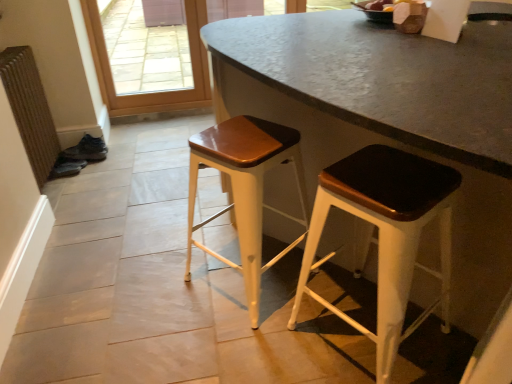
Question: Should I look upward or downward to see brown textured radiator at left?

Choices:
 (A) down
 (B) up

Answer: (B)

Question: Is wooden seat stool at center, acting as the 2th stool starting from the right, behind matte black stool at center, which is counted as the first stool, starting from the right?

Choices:
 (A) yes
 (B) no

Answer: (A)

Question: Is wooden seat stool at center, acting as the 2th stool starting from the right, far away from matte black stool at center, the 2th stool positioned from the left?

Choices:
 (A) yes
 (B) no

Answer: (B)

Question: Does wooden seat stool at center, the 1th stool when ordered from left to right, have a lesser height compared to matte black stool at center, the 2th stool positioned from the left?

Choices:
 (A) no
 (B) yes

Answer: (B)

Question: Considering the relative positions of wooden seat stool at center, the 1th stool when ordered from left to right, and matte black stool at center, which is counted as the first stool, starting from the right, in the image provided, is wooden seat stool at center, the 1th stool when ordered from left to right, to the left of matte black stool at center, which is counted as the first stool, starting from the right, from the viewer's perspective?

Choices:
 (A) no
 (B) yes

Answer: (B)

Question: Considering the relative positions of wooden seat stool at center, the 1th stool when ordered from left to right, and matte black stool at center, which is counted as the first stool, starting from the right, in the image provided, is wooden seat stool at center, the 1th stool when ordered from left to right, in front of matte black stool at center, which is counted as the first stool, starting from the right,?

Choices:
 (A) no
 (B) yes

Answer: (A)

Question: Is wooden seat stool at center, acting as the 2th stool starting from the right, at the right side of matte black stool at center, the 2th stool positioned from the left?

Choices:
 (A) yes
 (B) no

Answer: (B)

Question: Considering the relative positions of brown textured radiator at left and matte black stool at center, which is counted as the first stool, starting from the right, in the image provided, is brown textured radiator at left to the right of matte black stool at center, which is counted as the first stool, starting from the right, from the viewer's perspective?

Choices:
 (A) yes
 (B) no

Answer: (B)

Question: Is brown textured radiator at left thinner than matte black stool at center, the 2th stool positioned from the left?

Choices:
 (A) no
 (B) yes

Answer: (B)

Question: Considering the relative sizes of brown textured radiator at left and matte black stool at center, which is counted as the first stool, starting from the right, in the image provided, is brown textured radiator at left bigger than matte black stool at center, which is counted as the first stool, starting from the right,?

Choices:
 (A) no
 (B) yes

Answer: (A)

Question: Would you consider brown textured radiator at left to be distant from matte black stool at center, which is counted as the first stool, starting from the right?

Choices:
 (A) yes
 (B) no

Answer: (A)

Question: From the image's perspective, is brown textured radiator at left on top of matte black stool at center, the 2th stool positioned from the left?

Choices:
 (A) yes
 (B) no

Answer: (A)

Question: From a real-world perspective, is brown textured radiator at left below matte black stool at center, the 2th stool positioned from the left?

Choices:
 (A) yes
 (B) no

Answer: (B)

Question: Is brown textured radiator at left facing away from wooden seat stool at center, acting as the 2th stool starting from the right?

Choices:
 (A) yes
 (B) no

Answer: (B)